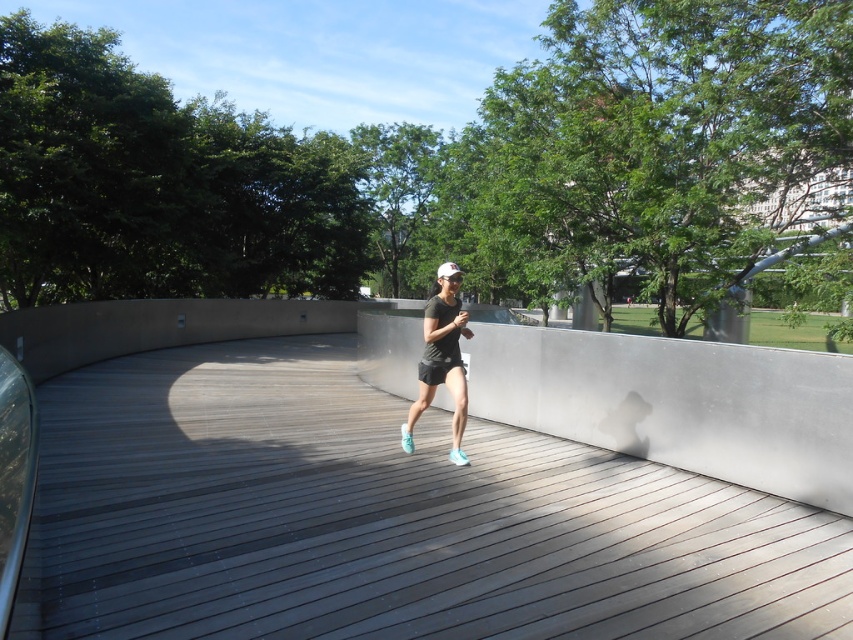
Question: Which object appears closest to the camera in this image?

Choices:
 (A) light blue mesh shoe at center
 (B) matte black shorts at center
 (C) black fabric shorts at center

Answer: (B)

Question: Is wooden at center bigger than matte black shorts at center?

Choices:
 (A) yes
 (B) no

Answer: (A)

Question: Is wooden at center positioned behind matte black shorts at center?

Choices:
 (A) yes
 (B) no

Answer: (B)

Question: Which object is the closest to the wooden at center?

Choices:
 (A) light blue fabric running shoe at center
 (B) black fabric shorts at center
 (C) matte black shorts at center
 (D) light blue mesh shoe at center

Answer: (B)

Question: Does black fabric shorts at center appear on the left side of light blue mesh shoe at center?

Choices:
 (A) no
 (B) yes

Answer: (B)

Question: Which object appears farthest from the camera in this image?

Choices:
 (A) light blue fabric running shoe at center
 (B) light blue mesh shoe at center
 (C) black fabric shorts at center
 (D) matte black shorts at center

Answer: (A)